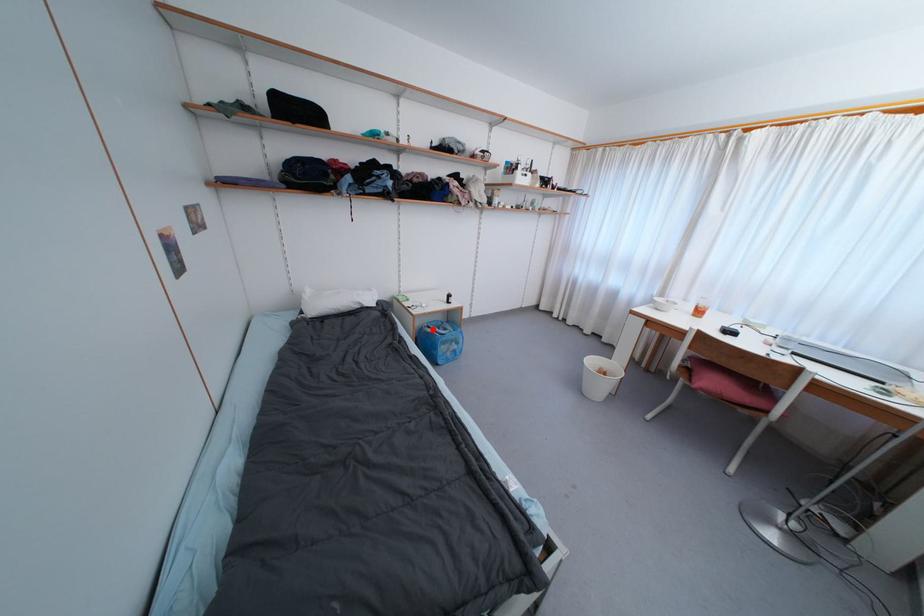
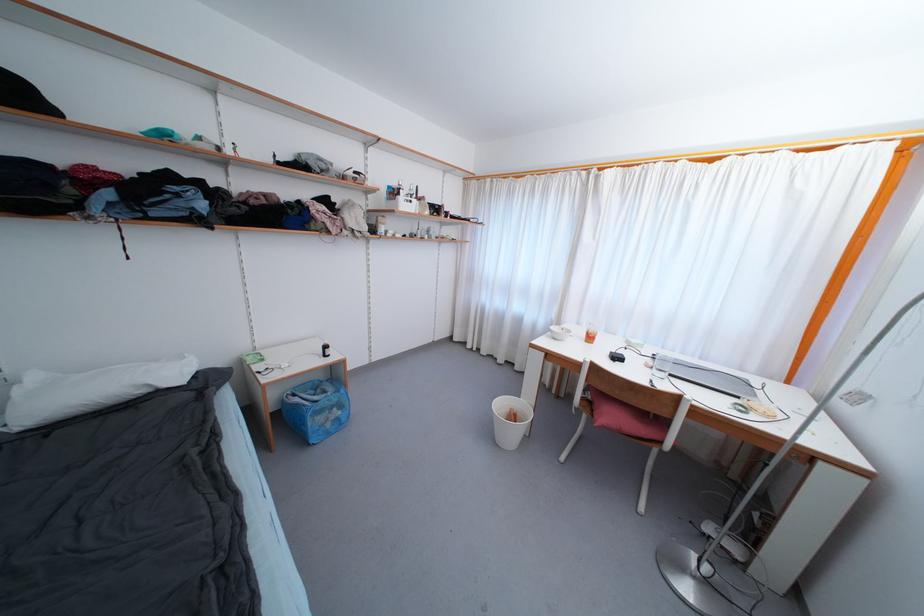
In the second image, find the point that corresponds to the highlighted location in the first image.

(298, 398)